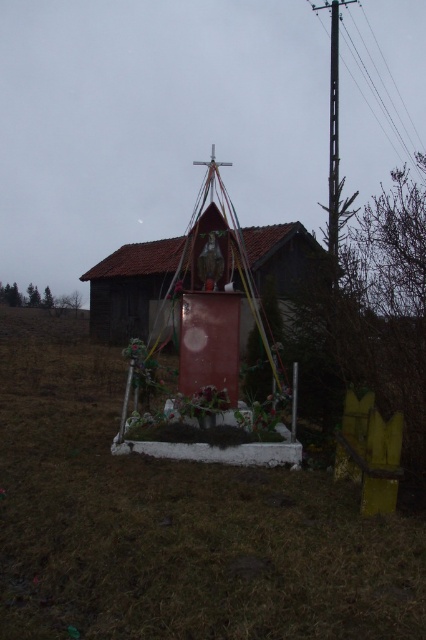
In the scene shown: Is smooth wooden hut at center above metallic pole at upper right?

Actually, smooth wooden hut at center is below metallic pole at upper right.

Between point (293, 227) and point (368, 20), which one is positioned in front?

Point (293, 227) is more forward.

Locate an element on the screen. Image resolution: width=426 pixels, height=640 pixels. smooth wooden hut at center is located at coordinates (129, 289).